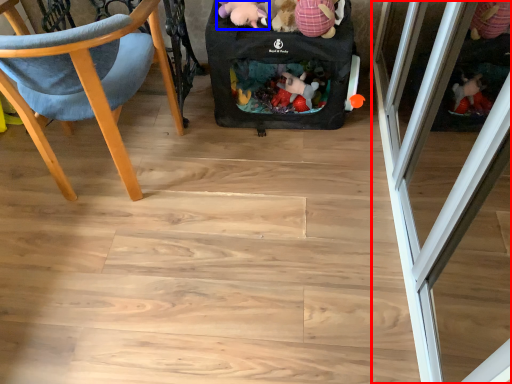
Question: Which point is further to the camera, screen door (highlighted by a red box) or toy (highlighted by a blue box)?

Choices:
 (A) screen door
 (B) toy

Answer: (B)